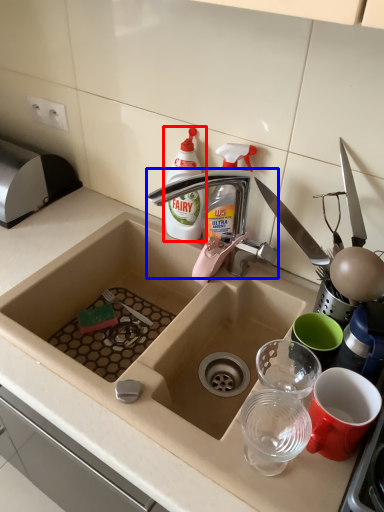
Question: Which object is further to the camera taking this photo, bottle (highlighted by a red box) or tap (highlighted by a blue box)?

Choices:
 (A) bottle
 (B) tap

Answer: (A)